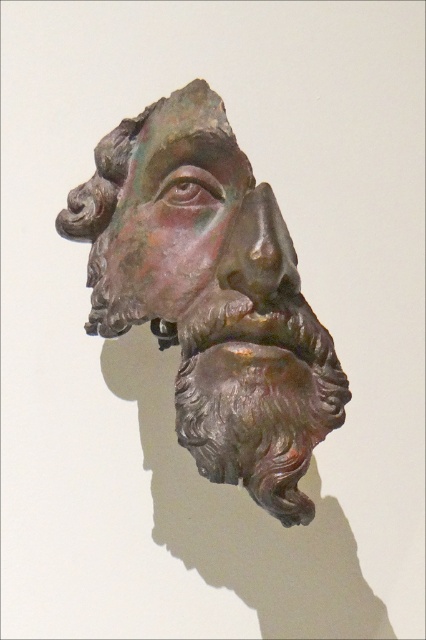
You are an art conservator examining the bronze sculpture. You notice two parts of the sculpture labeled as the bronze head at center and the rusty bronze face at center. Which part is taller?

The bronze head at center is taller than the rusty bronze face at center.

You are an art conservator examining the bronze sculpture. You notice a specific point at coordinates (210,294) on the image. Based on the description, what does this point most likely indicate about the sculpture?

The point at coordinates (210,294) marks the bronze head at center, indicating that the sculpture is centrally positioned in the image.